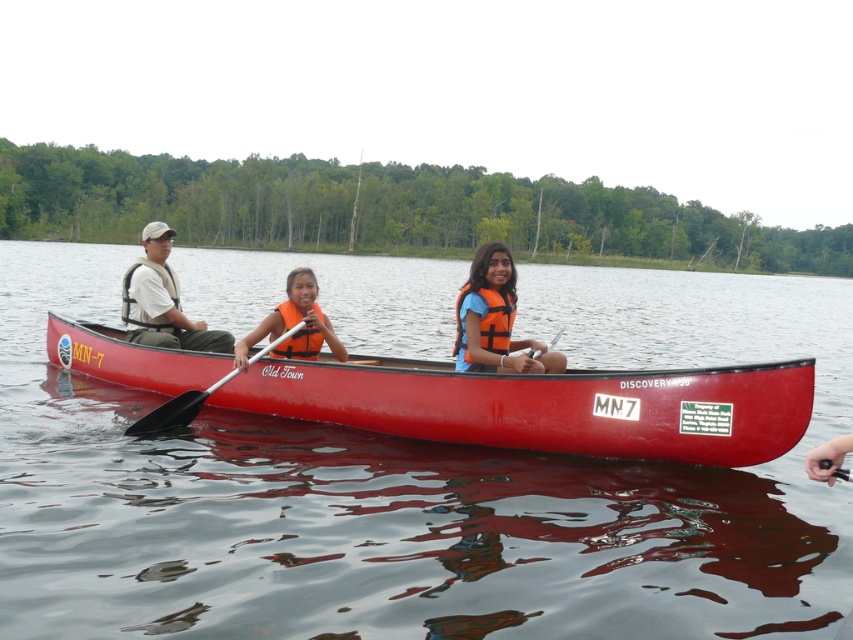
From the picture: Does transparent water at center come behind matte red canoe at center?

No, transparent water at center is in front of matte red canoe at center.

Which is in front, point (543, 627) or point (581, 372)?

Point (543, 627) is in front.

This screenshot has height=640, width=853. Describe the element at coordinates (416, 488) in the screenshot. I see `transparent water at center` at that location.

This screenshot has width=853, height=640. What are the coordinates of `transparent water at center` in the screenshot? It's located at (416, 488).

Between matte red canoe at center and orange life vest at center, which one appears on the right side from the viewer's perspective?

From the viewer's perspective, orange life vest at center appears more on the right side.

Is matte red canoe at center shorter than orange life vest at center?

Indeed, matte red canoe at center has a lesser height compared to orange life vest at center.

Who is more distant from viewer, (47, 332) or (505, 321)?

The point (47, 332) is behind.

At what (x,y) coordinates should I click in order to perform the action: click on matte red canoe at center. Please return your answer as a coordinate pair (x, y). The width and height of the screenshot is (853, 640). Looking at the image, I should click on (546, 404).

Does matte white life vest at left have a greater height compared to metallic silver paddle at center?

Yes.

Is matte white life vest at left below metallic silver paddle at center?

Actually, matte white life vest at left is above metallic silver paddle at center.

Which is in front, point (157, 320) or point (152, 433)?

Point (152, 433) is in front.

At what (x,y) coordinates should I click in order to perform the action: click on matte white life vest at left. Please return your answer as a coordinate pair (x, y). Looking at the image, I should click on (161, 300).